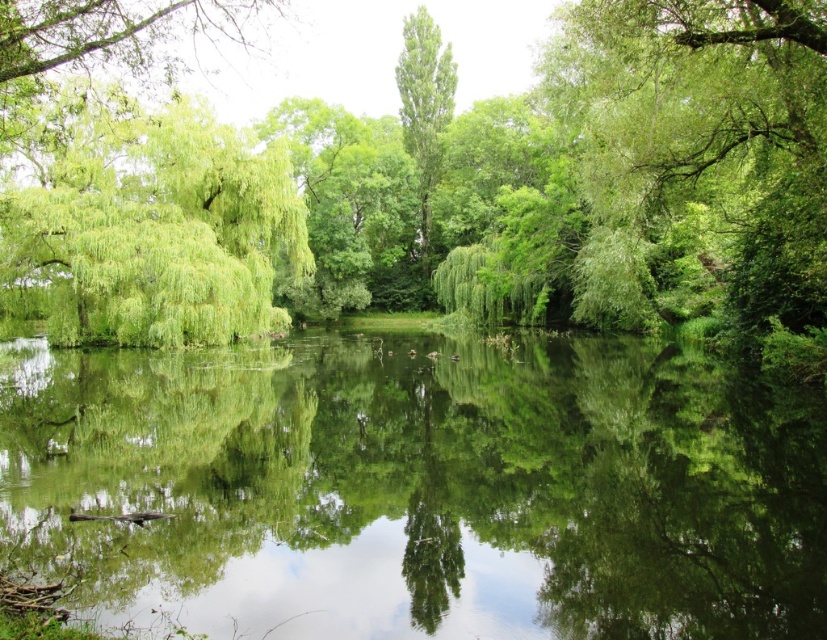
Between green leafy tree at center and green leafy willow at left, which one is positioned lower?

green leafy willow at left is lower down.

Can you confirm if green leafy tree at center is bigger than green leafy willow at left?

Correct, green leafy tree at center is larger in size than green leafy willow at left.

Measure the distance between green leafy tree at center and camera.

They are 29.01 feet apart.

Identify the location of green leafy tree at center. The height and width of the screenshot is (640, 827). (431, 179).

Does green reflective water at center appear over green leafy willow at center?

No, green reflective water at center is not above green leafy willow at center.

Who is more distant from viewer, (414, 429) or (524, 284)?

Positioned behind is point (524, 284).

Is point (477, 563) positioned behind point (462, 284)?

No.

The height and width of the screenshot is (640, 827). I want to click on green reflective water at center, so click(x=419, y=486).

Consider the image. Is green leafy willow at left shorter than green leafy willow at center?

No.

Is green leafy willow at left wider than green leafy willow at center?

Yes.

At what (x,y) coordinates should I click in order to perform the action: click on green leafy willow at left. Please return your answer as a coordinate pair (x, y). The image size is (827, 640). Looking at the image, I should click on (151, 221).